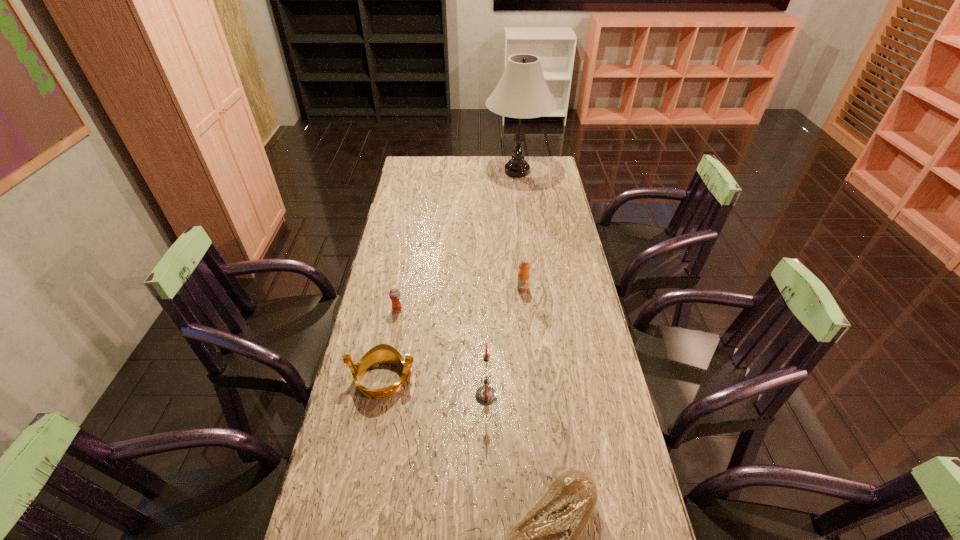
Locate an element on the screen. vacant space in between the lamp and the left orange juice is located at coordinates (457, 241).

In order to click on free space between the candle and the farthest object in this screenshot , I will do `click(501, 284)`.

Find the location of a particular element. Image resolution: width=960 pixels, height=540 pixels. free space between the candle and the fourth nearest object is located at coordinates (442, 353).

Locate which object ranks third in proximity to the fifth shortest object. Please provide its 2D coordinates. Your answer should be formatted as a tuple, i.e. [(x, y)], where the tuple contains the x and y coordinates of a point satisfying the conditions above.

[(394, 294)]

Image resolution: width=960 pixels, height=540 pixels. In order to click on object that is the fifth nearest to the farther orange juice in this screenshot , I will do `click(546, 539)`.

What are the coordinates of `vacant space that satisfies the following two spatial constraints: 1. on the front side of the nearer orange juice; 2. at the front emblem of the tiara` in the screenshot? It's located at (384, 379).